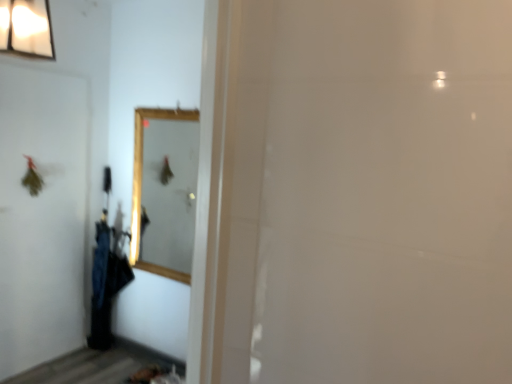
Question: From a real-world perspective, is white matte screen door at left under black fabric umbrella at left?

Choices:
 (A) yes
 (B) no

Answer: (B)

Question: Does white matte screen door at left appear on the right side of black fabric umbrella at left?

Choices:
 (A) no
 (B) yes

Answer: (A)

Question: Considering the relative positions of white matte screen door at left and black fabric umbrella at left in the image provided, is white matte screen door at left to the left of black fabric umbrella at left from the viewer's perspective?

Choices:
 (A) no
 (B) yes

Answer: (B)

Question: Does white matte screen door at left have a greater width compared to black fabric umbrella at left?

Choices:
 (A) yes
 (B) no

Answer: (B)

Question: Can you confirm if white matte screen door at left is smaller than black fabric umbrella at left?

Choices:
 (A) yes
 (B) no

Answer: (A)

Question: Does white matte screen door at left have a lesser width compared to black fabric umbrella at left?

Choices:
 (A) no
 (B) yes

Answer: (B)

Question: Is wooden framed mirror at center thinner than white matte screen door at left?

Choices:
 (A) yes
 (B) no

Answer: (B)

Question: From the image's perspective, is wooden framed mirror at center on top of white matte screen door at left?

Choices:
 (A) no
 (B) yes

Answer: (B)

Question: From a real-world perspective, is wooden framed mirror at center under white matte screen door at left?

Choices:
 (A) yes
 (B) no

Answer: (B)

Question: Is wooden framed mirror at center outside of white matte screen door at left?

Choices:
 (A) no
 (B) yes

Answer: (B)

Question: Is wooden framed mirror at center smaller than white matte screen door at left?

Choices:
 (A) no
 (B) yes

Answer: (B)

Question: Is wooden framed mirror at center not close to white matte screen door at left?

Choices:
 (A) no
 (B) yes

Answer: (A)

Question: Does black fabric umbrella at left appear on the right side of wooden framed mirror at center?

Choices:
 (A) no
 (B) yes

Answer: (A)